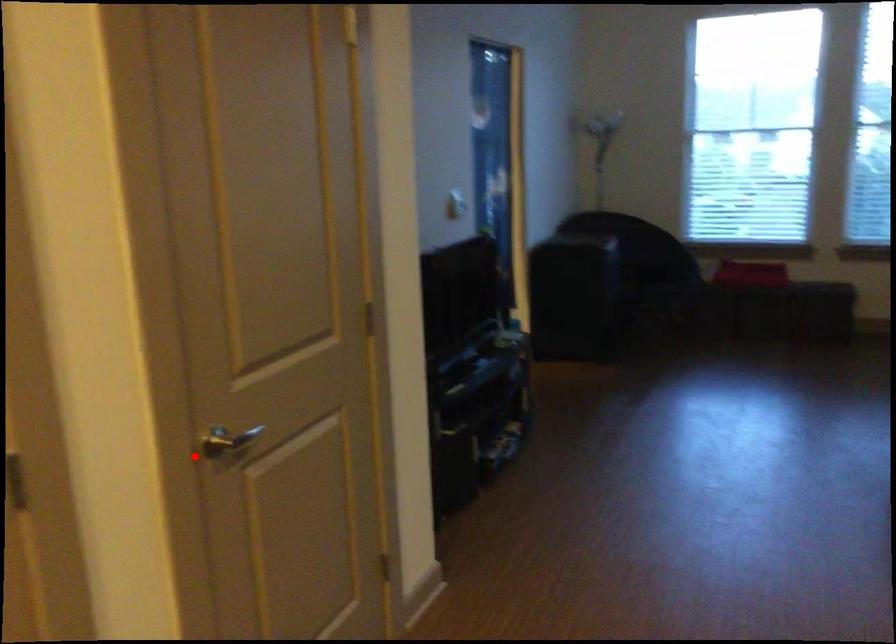
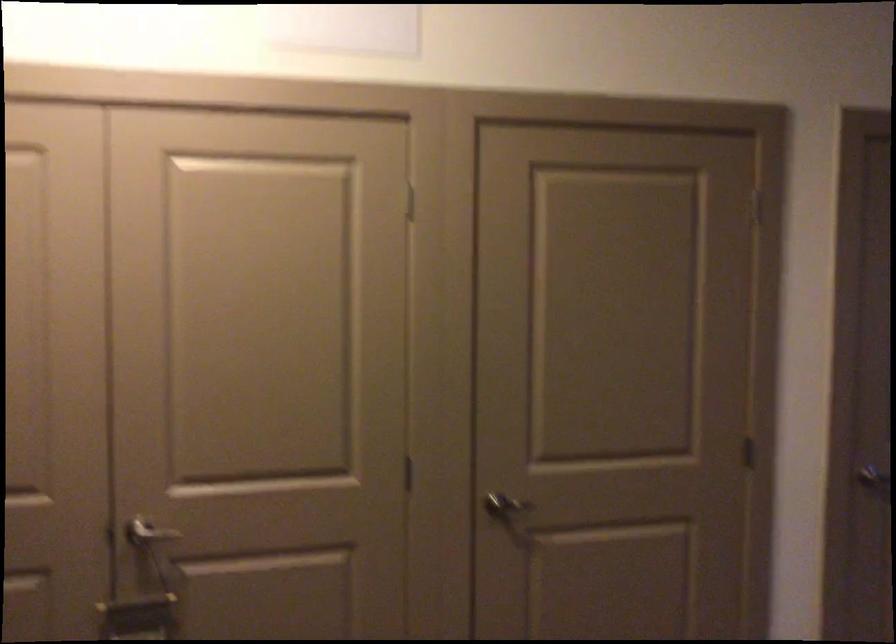
Question: I am providing you with two images of the same scene from different viewpoints. In image1, a red point is highlighted. Considering the same 3D point in image2, which of the following is correct?

Choices:
 (A) It is closer
 (B) It is farther

Answer: (B)